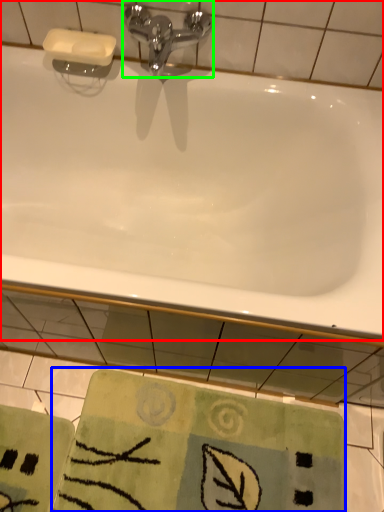
Question: Based on their relative distances, which object is farther from bathtub (highlighted by a red box)? Choose from beach towel (highlighted by a blue box) and tap (highlighted by a green box).

Choices:
 (A) beach towel
 (B) tap

Answer: (A)